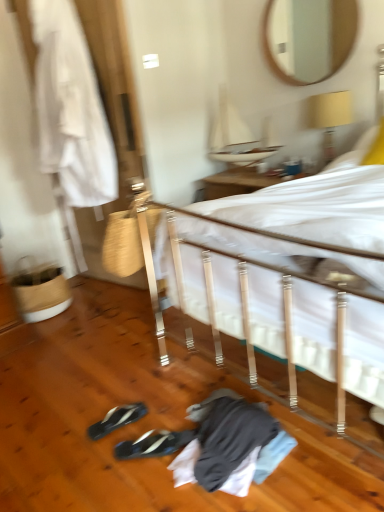
The width and height of the screenshot is (384, 512). I want to click on wooden mirror at upper center, so click(308, 38).

Describe the element at coordinates (308, 38) in the screenshot. I see `wooden mirror at upper center` at that location.

I want to click on yellow fabric lampshade at upper right, so point(329,116).

Where is `white fabric at left`? The height and width of the screenshot is (512, 384). white fabric at left is located at coordinates (118, 154).

Based on the photo, which object is positioned more to the right, white fabric bed at center or black synthetic sneakers at lower left, the second footwear viewed from the front?

white fabric bed at center is more to the right.

Does white fabric bed at center turn towards black synthetic sneakers at lower left, the second footwear viewed from the front?

Yes, white fabric bed at center is turned towards black synthetic sneakers at lower left, the second footwear viewed from the front.

In the scene shown: Does white fabric bed at center come behind black synthetic sneakers at lower left, the second footwear viewed from the front?

No, white fabric bed at center is closer to the viewer.

Is white fabric bed at center in front of yellow fabric lampshade at upper right?

Yes, it is.

From the image's perspective, is white fabric bed at center located beneath yellow fabric lampshade at upper right?

Yes, from the image's perspective, white fabric bed at center is beneath yellow fabric lampshade at upper right.

Is yellow fabric lampshade at upper right a part of white fabric bed at center?

No, yellow fabric lampshade at upper right is not inside white fabric bed at center.

Where is `footwear that is the 1st one when counting rightward from the white fabric at left`? footwear that is the 1st one when counting rightward from the white fabric at left is located at coordinates click(117, 419).

Which is more distant, [96,424] or [22,73]?

The point [22,73] is behind.

Who is smaller, black synthetic sneakers at lower left, the second footwear viewed from the front, or white fabric at left?

With smaller size is black synthetic sneakers at lower left, the second footwear viewed from the front.

In terms of height, does black synthetic sneakers at lower left, which appears as the 1th footwear when viewed from the back, look taller or shorter compared to white fabric at left?

black synthetic sneakers at lower left, which appears as the 1th footwear when viewed from the back, is shorter than white fabric at left.

From a real-world perspective, is black synthetic sneakers at lower left, the second footwear viewed from the front, above or below white fabric bed at center?

In terms of real-world spatial position, black synthetic sneakers at lower left, the second footwear viewed from the front, is below white fabric bed at center.

Considering the relative positions of black synthetic sneakers at lower left, the second footwear viewed from the front, and white fabric bed at center in the image provided, is black synthetic sneakers at lower left, the second footwear viewed from the front, to the left of white fabric bed at center from the viewer's perspective?

Yes.

Is point (102, 428) farther from viewer compared to point (377, 398)?

That is True.

Which of these two, black synthetic sneakers at lower left, the second footwear viewed from the front, or white fabric bed at center, is bigger?

white fabric bed at center is bigger.

Is white fabric at left facing towards black synthetic sneakers at lower center, arranged as the 1th footwear when viewed from the front?

No, white fabric at left is not oriented towards black synthetic sneakers at lower center, arranged as the 1th footwear when viewed from the front.

This screenshot has width=384, height=512. I want to click on closet above the black synthetic sneakers at lower center, the second footwear in the back-to-front sequence (from the image's perspective), so click(118, 154).

Is the depth of white fabric bed at center greater than that of wooden mirror at upper center?

No, white fabric bed at center is in front of wooden mirror at upper center.

Is white fabric bed at center thinner than wooden mirror at upper center?

No.

How many degrees apart are the facing directions of white fabric bed at center and wooden mirror at upper center?

0.455 degrees.

In terms of size, does white fabric bed at center appear bigger or smaller than wooden mirror at upper center?

white fabric bed at center is bigger than wooden mirror at upper center.

Is the depth of black synthetic sneakers at lower center, arranged as the 1th footwear when viewed from the front, greater than that of wooden mirror at upper center?

No, black synthetic sneakers at lower center, arranged as the 1th footwear when viewed from the front, is in front of wooden mirror at upper center.

Is point (125, 448) closer or farther from the camera than point (297, 60)?

Point (125, 448) is positioned closer to the camera compared to point (297, 60).

Does black synthetic sneakers at lower center, arranged as the 1th footwear when viewed from the front, turn towards wooden mirror at upper center?

No, black synthetic sneakers at lower center, arranged as the 1th footwear when viewed from the front, is not turned towards wooden mirror at upper center.

Between black synthetic sneakers at lower center, arranged as the 1th footwear when viewed from the front, and wooden mirror at upper center, which one has less height?

black synthetic sneakers at lower center, arranged as the 1th footwear when viewed from the front.

Which footwear is the 2nd one when counting from the left side of the white fabric bed at center? Please provide its 2D coordinates.

[(117, 419)]

In order to click on bed that is in front of the yellow fabric lampshade at upper right in this screenshot , I will do `click(252, 275)`.

Considering their positions, is yellow fabric lampshade at upper right positioned further to wooden mirror at upper center than white fabric bed at center?

white fabric bed at center lies further to wooden mirror at upper center than the other object.

Looking at the image, which one is located closer to wooden mirror at upper center, yellow fabric lampshade at upper right or white fabric at left?

yellow fabric lampshade at upper right is closer to wooden mirror at upper center.

Based on their spatial positions, is black synthetic sneakers at lower left, which appears as the 1th footwear when viewed from the back, or white fabric bed at center further from yellow fabric lampshade at upper right?

black synthetic sneakers at lower left, which appears as the 1th footwear when viewed from the back.

Looking at the image, which one is located further to wooden mirror at upper center, black synthetic sneakers at lower left, the second footwear viewed from the front, or white fabric bed at center?

Among the two, black synthetic sneakers at lower left, the second footwear viewed from the front, is located further to wooden mirror at upper center.

From the image, which object appears to be nearer to black synthetic sneakers at lower left, which appears as the 1th footwear when viewed from the back, wooden mirror at upper center or black synthetic sneakers at lower center, arranged as the 1th footwear when viewed from the front?

Among the two, black synthetic sneakers at lower center, arranged as the 1th footwear when viewed from the front, is located nearer to black synthetic sneakers at lower left, which appears as the 1th footwear when viewed from the back.

Looking at the image, which one is located further to white fabric bed at center, black synthetic sneakers at lower left, which appears as the 1th footwear when viewed from the back, or yellow fabric lampshade at upper right?

yellow fabric lampshade at upper right is further to white fabric bed at center.

When comparing their distances from white fabric at left, does white fabric bed at center or black synthetic sneakers at lower left, which appears as the 1th footwear when viewed from the back, seem closer?

The object closer to white fabric at left is white fabric bed at center.

Estimate the real-world distances between objects in this image. Which object is closer to yellow fabric lampshade at upper right, wooden mirror at upper center or white fabric at left?

Among the two, wooden mirror at upper center is located nearer to yellow fabric lampshade at upper right.

Where is `footwear between black synthetic sneakers at lower left, the second footwear viewed from the front, and white fabric bed at center`? Image resolution: width=384 pixels, height=512 pixels. footwear between black synthetic sneakers at lower left, the second footwear viewed from the front, and white fabric bed at center is located at coordinates (154, 444).

The image size is (384, 512). Find the location of `footwear between yellow fabric lampshade at upper right and black synthetic sneakers at lower center, arranged as the 1th footwear when viewed from the front, from top to bottom`. footwear between yellow fabric lampshade at upper right and black synthetic sneakers at lower center, arranged as the 1th footwear when viewed from the front, from top to bottom is located at coordinates (117, 419).

At what (x,y) coordinates should I click in order to perform the action: click on mirror between white fabric bed at center and yellow fabric lampshade at upper right in the front-back direction. Please return your answer as a coordinate pair (x, y). Looking at the image, I should click on (308, 38).

Image resolution: width=384 pixels, height=512 pixels. Find the location of `bed that lies between wooden mirror at upper center and black synthetic sneakers at lower center, the second footwear in the back-to-front sequence, from top to bottom`. bed that lies between wooden mirror at upper center and black synthetic sneakers at lower center, the second footwear in the back-to-front sequence, from top to bottom is located at coordinates (252, 275).